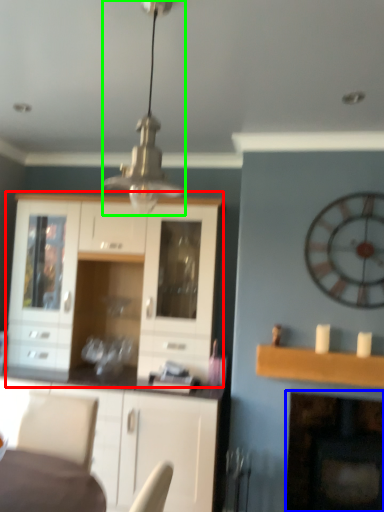
Question: Considering the real-world distances, which object is farthest from cabinetry (highlighted by a red box)? fireplace (highlighted by a blue box) or light fixture (highlighted by a green box)?

Choices:
 (A) fireplace
 (B) light fixture

Answer: (A)